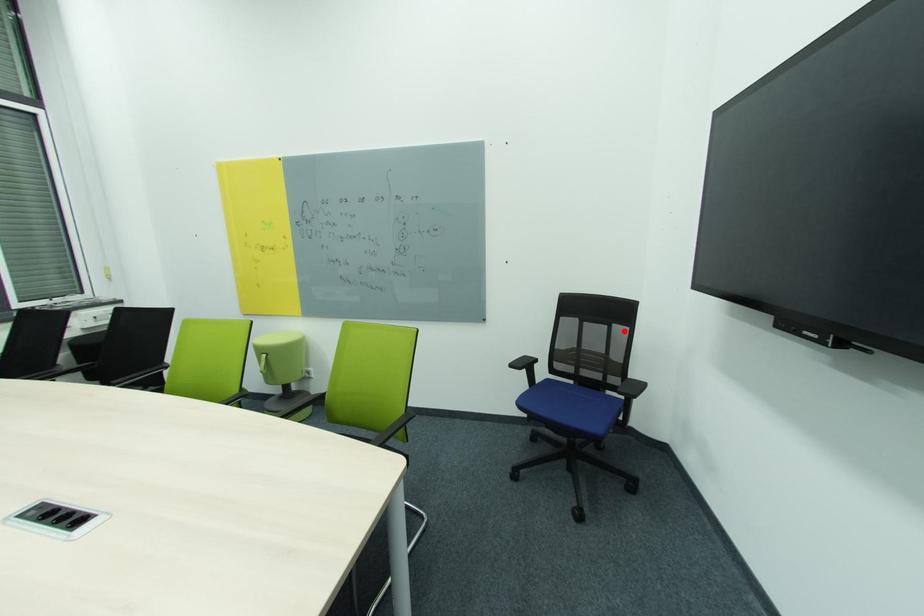
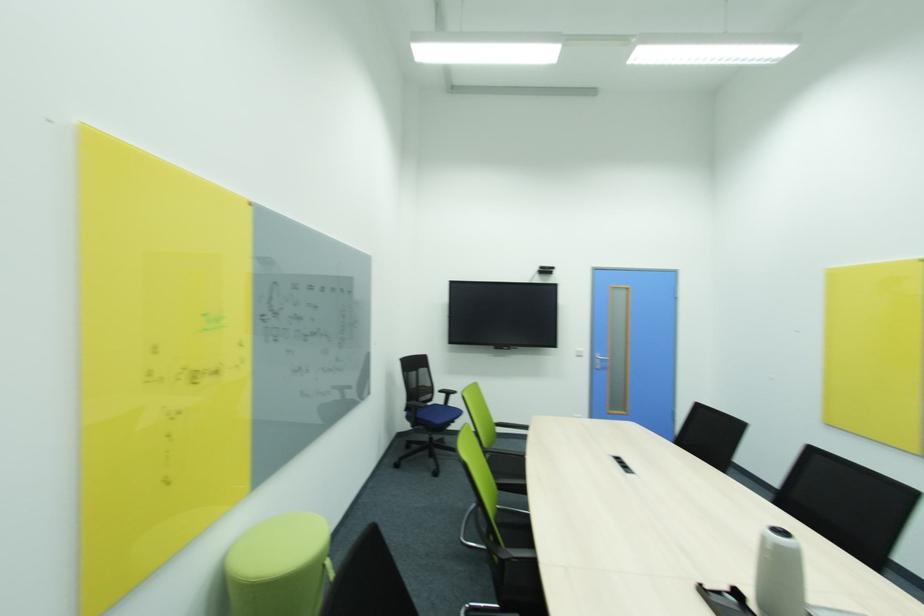
Locate, in the second image, the point that corresponds to the highlighted location in the first image.

(428, 371)